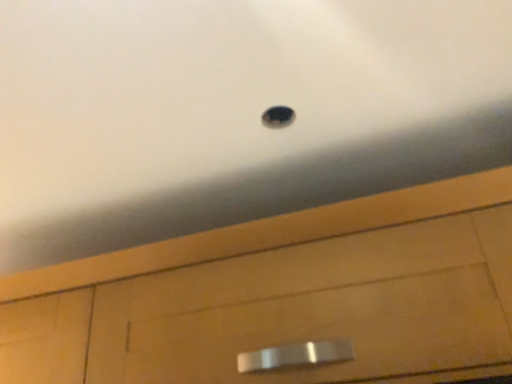
Describe the element at coordinates (278, 117) in the screenshot. I see `black matte hole at upper center` at that location.

Find the location of a particular element. The width and height of the screenshot is (512, 384). black matte hole at upper center is located at coordinates (278, 117).

Find the location of `black matte hole at upper center`. black matte hole at upper center is located at coordinates (278, 117).